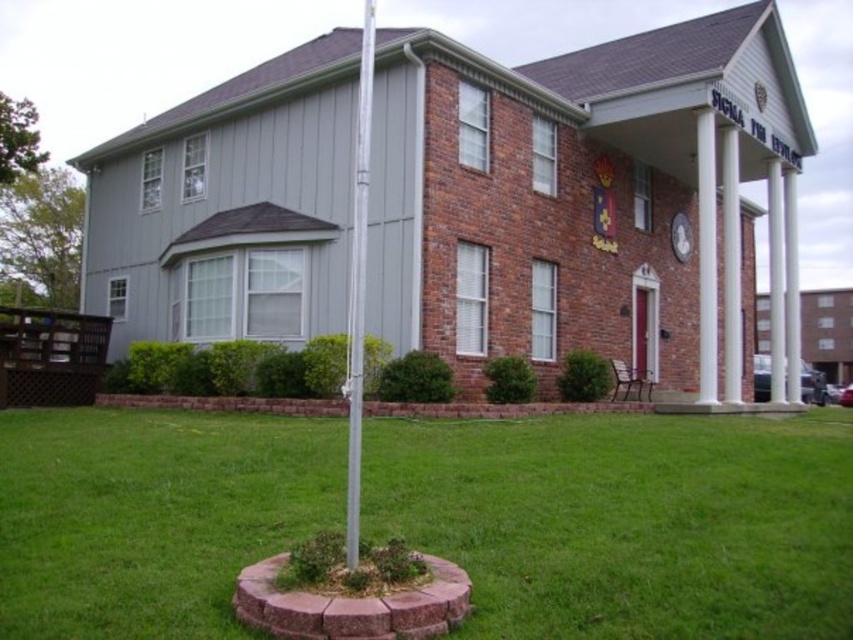
You are an architect evaluating the symmetry of the building. Which of the two columns, the white smooth column at center or the white smooth pillar at right, is narrower?

The white smooth column at center is narrower than the white smooth pillar at right.

You are an architect designing a new porch for a building. You have two elements to place on the porch area described in the scene. The silver metallic pole at center and the white smooth column at center. Which element has a greater width?

The silver metallic pole at center has a greater width than the white smooth column at center according to the description.

Looking at this image, you are planning to place a large garden statue that requires a 3x3 meter space. Based on the scene, can the green grass at center accommodate the statue without encroaching on the white marble pillar at right?

Result: The green grass at center has a larger size compared to white marble pillar at right, so it should have enough space to accommodate the 3x3 meter garden statue without encroaching on the pillar.